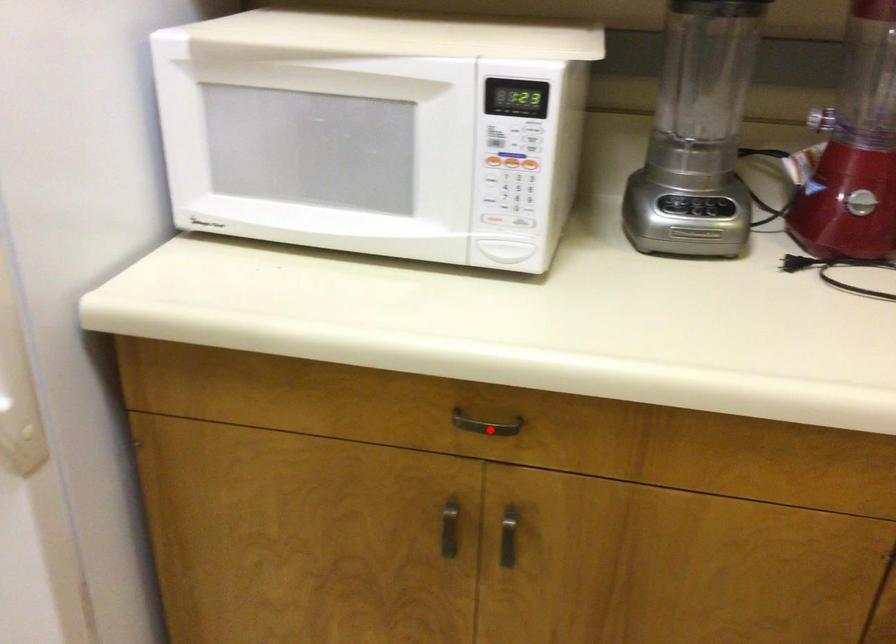
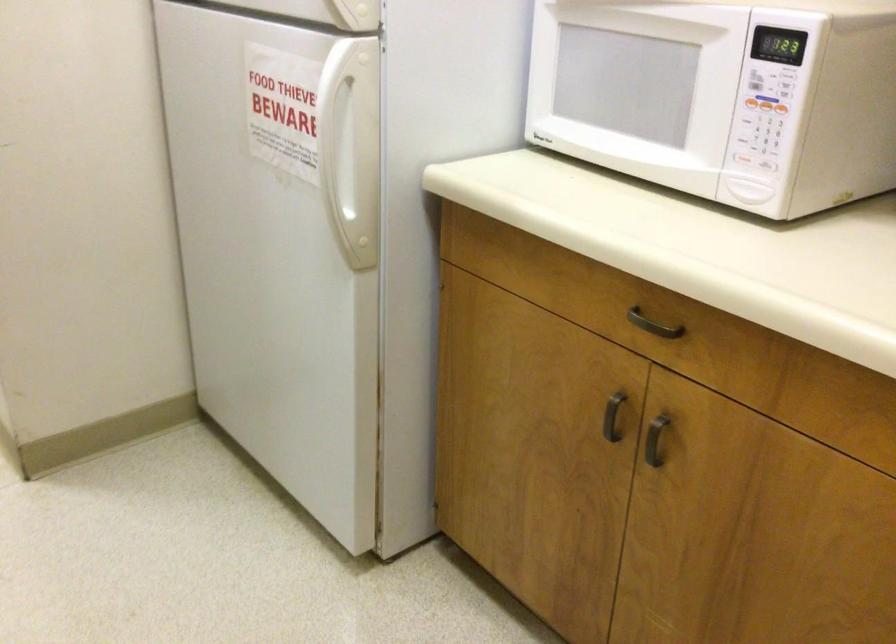
Find the pixel in the second image that matches the highlighted location in the first image.

(652, 325)